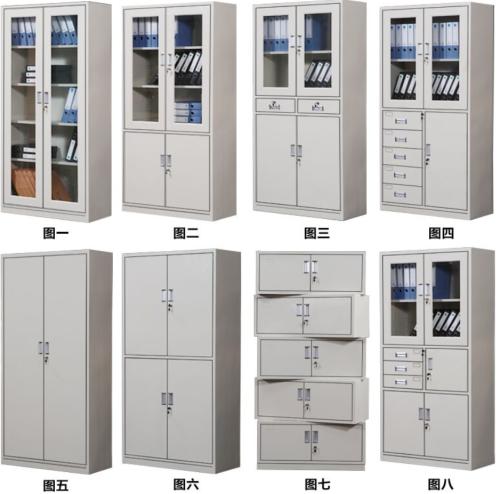
Where is `double door white cabinet bottom left corner`? The height and width of the screenshot is (494, 500). double door white cabinet bottom left corner is located at coordinates (61, 378).